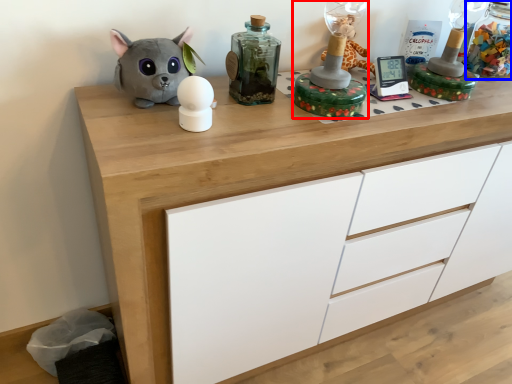
Question: Among these objects, which one is nearest to the camera, toy (highlighted by a red box) or bottle (highlighted by a blue box)?

Choices:
 (A) toy
 (B) bottle

Answer: (A)